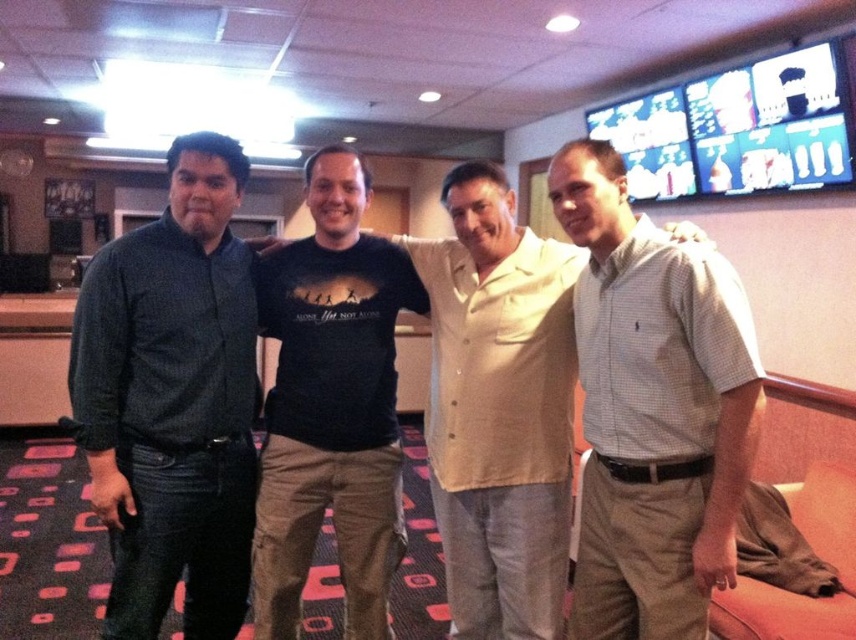
Which of these two, white checkered shirt at center or light beige shirt at center, stands taller?

With more height is light beige shirt at center.

Which is more to the left, white checkered shirt at center or light beige shirt at center?

light beige shirt at center

Is point (580, 304) positioned before point (453, 465)?

Yes, point (580, 304) is closer to viewer.

At what (x,y) coordinates should I click in order to perform the action: click on white checkered shirt at center. Please return your answer as a coordinate pair (x, y). Looking at the image, I should click on (652, 410).

Is dark blue shirt at left behind white checkered shirt at center?

That is True.

Does dark blue shirt at left appear under white checkered shirt at center?

Correct, dark blue shirt at left is located below white checkered shirt at center.

In the scene shown: Who is more forward, (241, 426) or (700, 355)?

Point (700, 355) is in front.

Locate an element on the screen. The width and height of the screenshot is (856, 640). dark blue shirt at left is located at coordinates (173, 401).

Does dark blue shirt at left have a greater height compared to light beige shirt at center?

Yes, dark blue shirt at left is taller than light beige shirt at center.

Is dark blue shirt at left smaller than light beige shirt at center?

Incorrect, dark blue shirt at left is not smaller in size than light beige shirt at center.

Is point (191, 241) positioned in front of point (513, 586)?

No.

This screenshot has height=640, width=856. Identify the location of dark blue shirt at left. (173, 401).